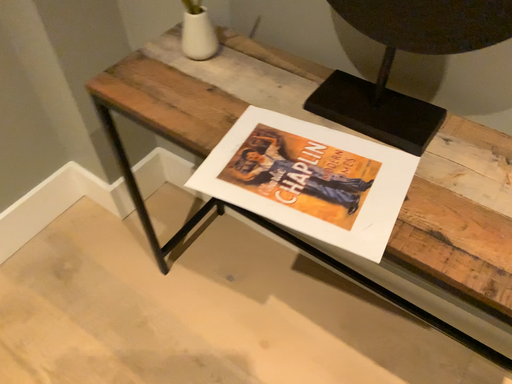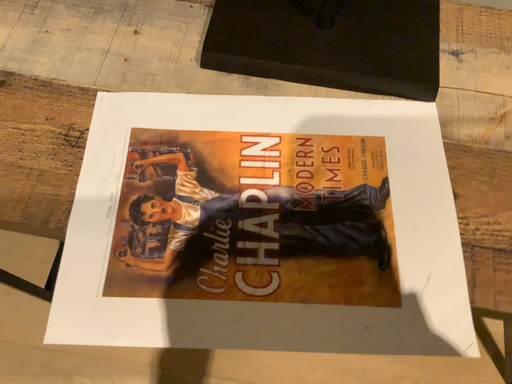
Question: How did the camera likely rotate when shooting the video?

Choices:
 (A) rotated right
 (B) rotated left

Answer: (A)